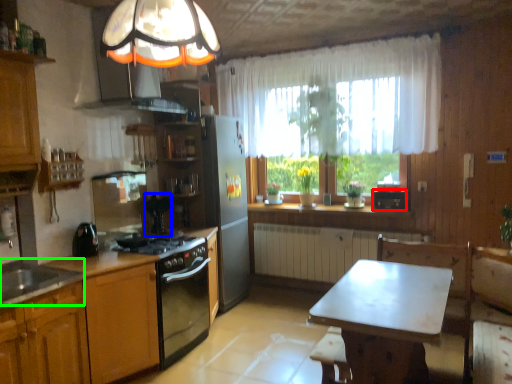
Question: Considering the real-world distances, which object is farthest from appliance (highlighted by a red box)? appliance (highlighted by a blue box) or sink (highlighted by a green box)?

Choices:
 (A) appliance
 (B) sink

Answer: (B)